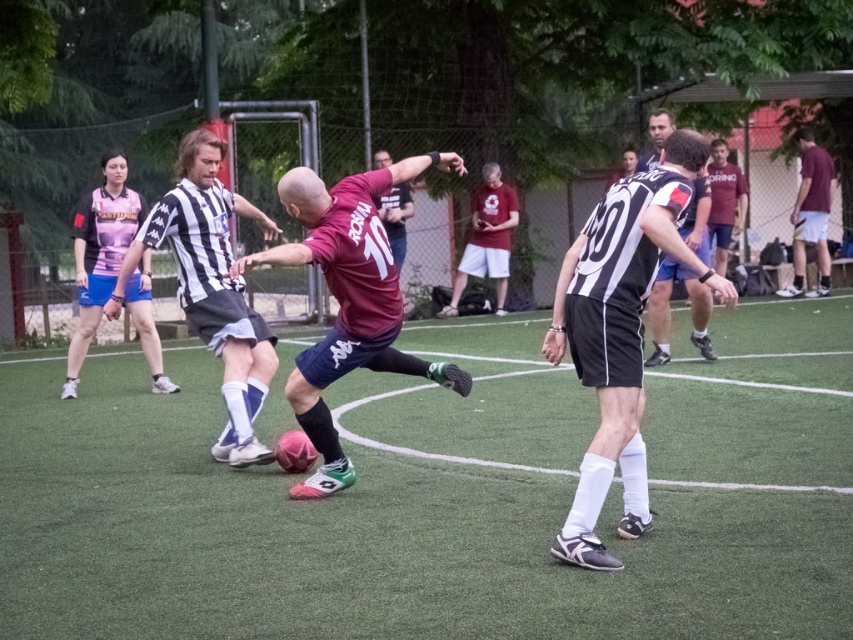
Between point (772, 444) and point (183, 225), which one is positioned in front?

Point (183, 225) is more forward.

Between green artificial turf at center and black and white striped jersey at left, which one has more height?

black and white striped jersey at left

Is point (265, 506) in front of point (223, 440)?

Yes, it is.

The image size is (853, 640). Identify the location of green artificial turf at center. (440, 497).

Does maroon jersey at center have a smaller size compared to black and white striped jersey at left?

Actually, maroon jersey at center might be larger than black and white striped jersey at left.

Is maroon jersey at center to the right of black and white striped jersey at left from the viewer's perspective?

Correct, you'll find maroon jersey at center to the right of black and white striped jersey at left.

Between point (305, 397) and point (224, 328), which one is positioned in front?

Point (305, 397) is more forward.

This screenshot has width=853, height=640. Find the location of `maroon jersey at center`. maroon jersey at center is located at coordinates (347, 300).

Can you confirm if green artificial turf at center is taller than maroon jersey at center?

In fact, green artificial turf at center may be shorter than maroon jersey at center.

Find the location of a particular element. This screenshot has width=853, height=640. green artificial turf at center is located at coordinates (440, 497).

Which is in front, point (74, 612) or point (331, 490)?

Point (74, 612)

The height and width of the screenshot is (640, 853). Identify the location of green artificial turf at center. (440, 497).